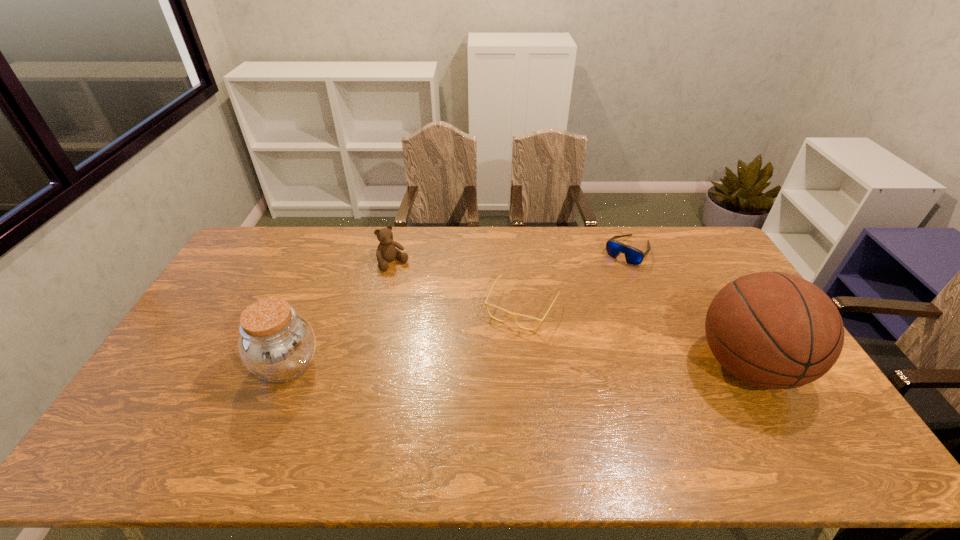
Locate an element on the screen. This screenshot has height=540, width=960. vacant point that satisfies the following two spatial constraints: 1. on the front side of the shortest object; 2. on the side with brand label of the basketball is located at coordinates (528, 366).

I want to click on free spot that satisfies the following two spatial constraints: 1. on the front side of the sunglasses; 2. on the side with brand label of the basketball, so click(676, 366).